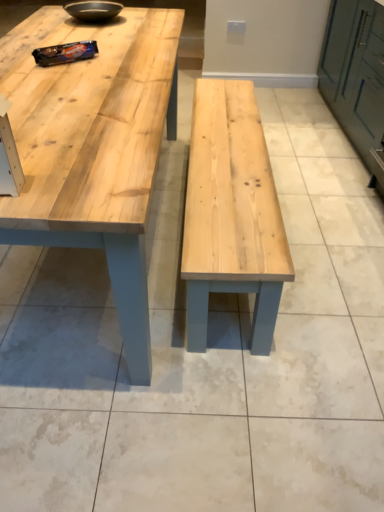
Question: Is natural wood table at center positioned with its back to green matte cabinet at right?

Choices:
 (A) yes
 (B) no

Answer: (B)

Question: From a real-world perspective, is natural wood table at center located beneath green matte cabinet at right?

Choices:
 (A) no
 (B) yes

Answer: (B)

Question: Is natural wood table at center not inside green matte cabinet at right?

Choices:
 (A) no
 (B) yes

Answer: (B)

Question: Can you confirm if natural wood table at center is positioned to the left of green matte cabinet at right?

Choices:
 (A) no
 (B) yes

Answer: (B)

Question: Is natural wood table at center next to green matte cabinet at right and touching it?

Choices:
 (A) yes
 (B) no

Answer: (B)

Question: Does point (367, 140) appear closer or farther from the camera than point (117, 210)?

Choices:
 (A) farther
 (B) closer

Answer: (A)

Question: From the image's perspective, is green matte cabinet at right positioned above or below natural wood table at center?

Choices:
 (A) above
 (B) below

Answer: (A)

Question: From a real-world perspective, is green matte cabinet at right physically located above or below natural wood table at center?

Choices:
 (A) above
 (B) below

Answer: (A)

Question: Is green matte cabinet at right to the left or to the right of natural wood table at center in the image?

Choices:
 (A) left
 (B) right

Answer: (B)

Question: Would you say green matte cabinet at right is inside or outside matte black bowl at upper center?

Choices:
 (A) inside
 (B) outside

Answer: (B)

Question: Is green matte cabinet at right in front of or behind matte black bowl at upper center in the image?

Choices:
 (A) behind
 (B) front

Answer: (B)

Question: From a real-world perspective, relative to matte black bowl at upper center, is green matte cabinet at right vertically above or below?

Choices:
 (A) below
 (B) above

Answer: (A)

Question: From their relative heights in the image, would you say green matte cabinet at right is taller or shorter than matte black bowl at upper center?

Choices:
 (A) short
 (B) tall

Answer: (B)

Question: Based on their sizes in the image, would you say matte black bowl at upper center is bigger or smaller than natural wood table at center?

Choices:
 (A) small
 (B) big

Answer: (A)

Question: Based on their positions, is matte black bowl at upper center located to the left or right of natural wood table at center?

Choices:
 (A) right
 (B) left

Answer: (B)